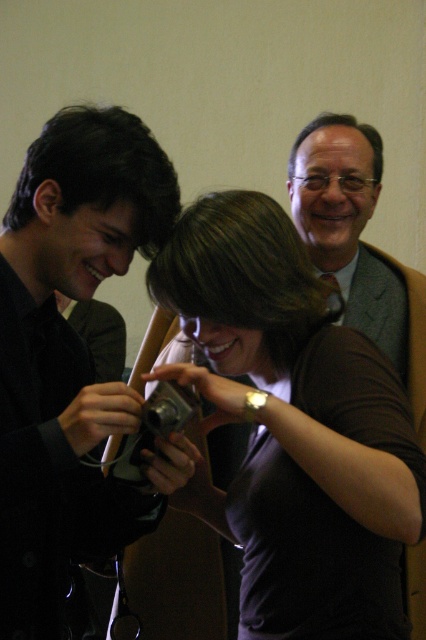
Looking at this image, based on the coordinates provided, which object is located at point (293, 426)?

The point (293, 426) corresponds to the matte black camera at center.

You are standing at the point marked by the coordinate point at (250, 404). The man in the black shirt is 37.86 inches away from you. Is he within a 3 feet personal space distance?

Yes, the man in the black shirt is 37.86 inches away, which is less than 3 feet, so he is within the personal space distance.